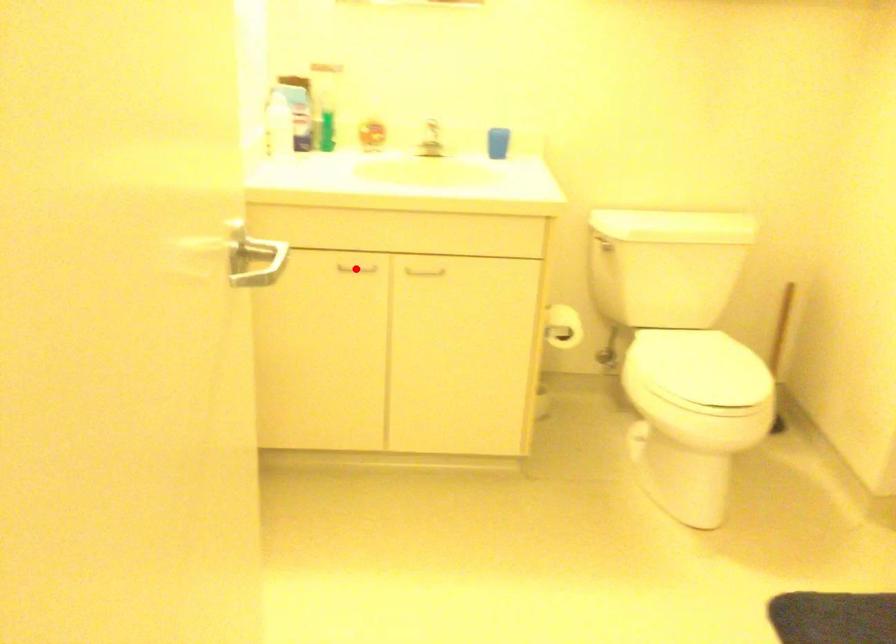
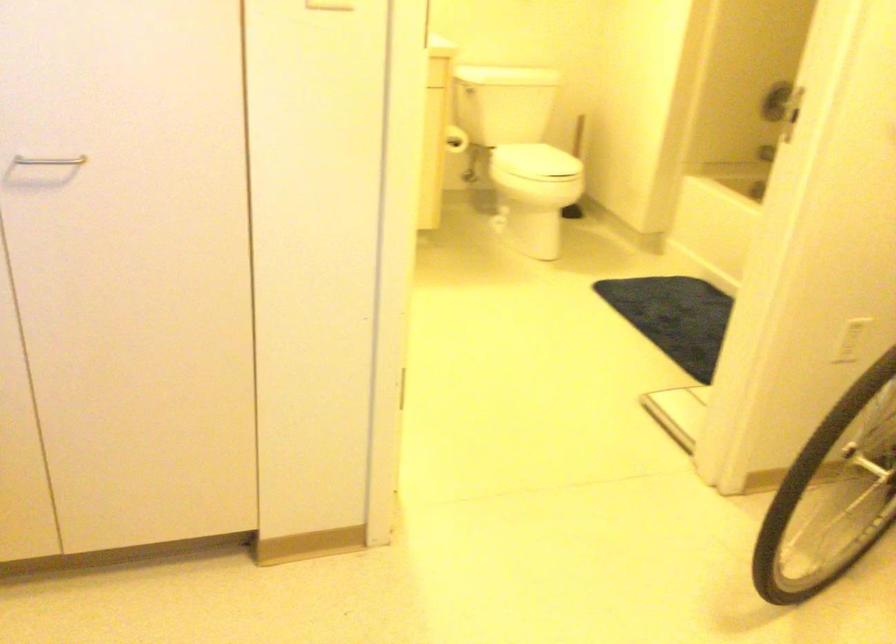
Question: I am providing you with two images of the same scene from different viewpoints. A red point is marked on the first image. Can you still see the location of the red point in image 2?

Choices:
 (A) Yes
 (B) No

Answer: (B)